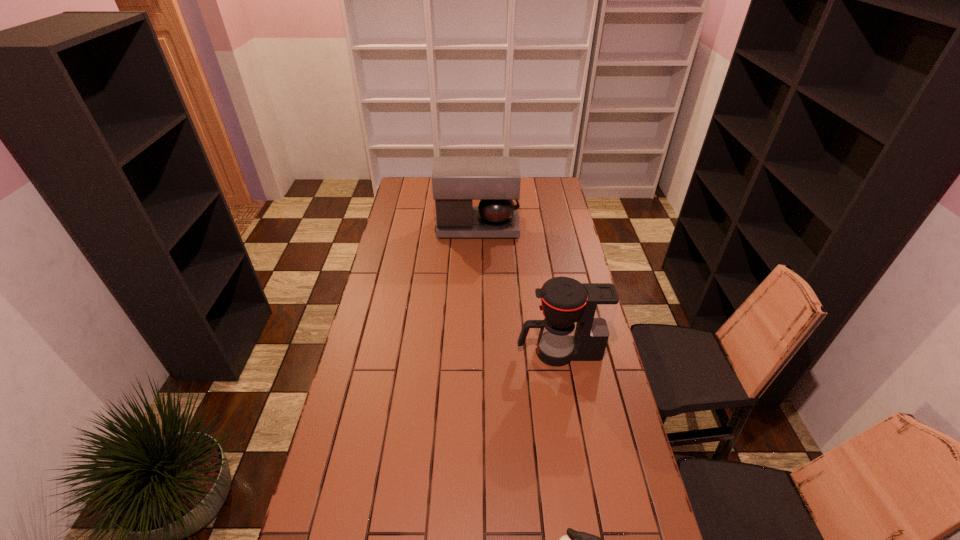
The image size is (960, 540). What are the coordinates of `the farther coffee maker` in the screenshot? It's located at click(x=456, y=181).

Find the location of a particular element. The image size is (960, 540). the second nearest object is located at coordinates (564, 300).

I want to click on free spot located on the carafe side of the farther coffee maker, so click(564, 227).

Identify the location of vacant space located 0.310m pour from the carafe of the nearer coffee maker. The image size is (960, 540). (431, 352).

Where is `vacant point located pour from the carafe of the nearer coffee maker`? This screenshot has width=960, height=540. vacant point located pour from the carafe of the nearer coffee maker is located at coordinates (484, 352).

Where is `free space located pour from the carafe of the nearer coffee maker`? The width and height of the screenshot is (960, 540). free space located pour from the carafe of the nearer coffee maker is located at coordinates (431, 352).

Identify the location of object at the right edge. (564, 300).

The width and height of the screenshot is (960, 540). In order to click on free location at the left edge of the desktop in this screenshot , I will do `click(396, 248)`.

Where is `free space at the right edge of the desktop`? The height and width of the screenshot is (540, 960). free space at the right edge of the desktop is located at coordinates (618, 398).

Where is `vacant space in between the second nearest object and the farthest object`? Image resolution: width=960 pixels, height=540 pixels. vacant space in between the second nearest object and the farthest object is located at coordinates (518, 289).